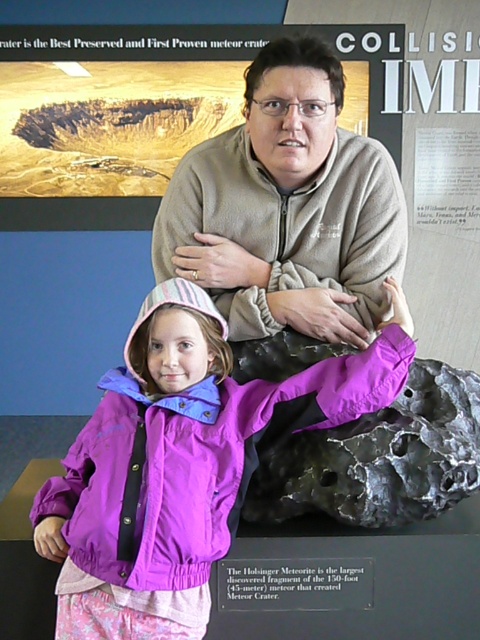
Question: Can you confirm if gray fleece sweater at center is positioned to the right of rough metallic rock at center?

Choices:
 (A) yes
 (B) no

Answer: (B)

Question: Which object is the closest to the gray fleece sweater at center?

Choices:
 (A) rough metallic rock at center
 (B) purple nylon jacket at center

Answer: (B)

Question: Which point is farther to the camera?

Choices:
 (A) pyautogui.click(x=354, y=481)
 (B) pyautogui.click(x=305, y=83)
 (C) pyautogui.click(x=167, y=378)

Answer: (B)

Question: Is the position of purple nylon jacket at center more distant than that of rough metallic rock at center?

Choices:
 (A) no
 (B) yes

Answer: (A)

Question: From the image, what is the correct spatial relationship of purple nylon jacket at center in relation to rough metallic rock at center?

Choices:
 (A) above
 (B) below

Answer: (B)

Question: Based on their relative distances, which object is farther from the purple nylon jacket at center?

Choices:
 (A) rough metallic rock at center
 (B) gray fleece sweater at center

Answer: (B)